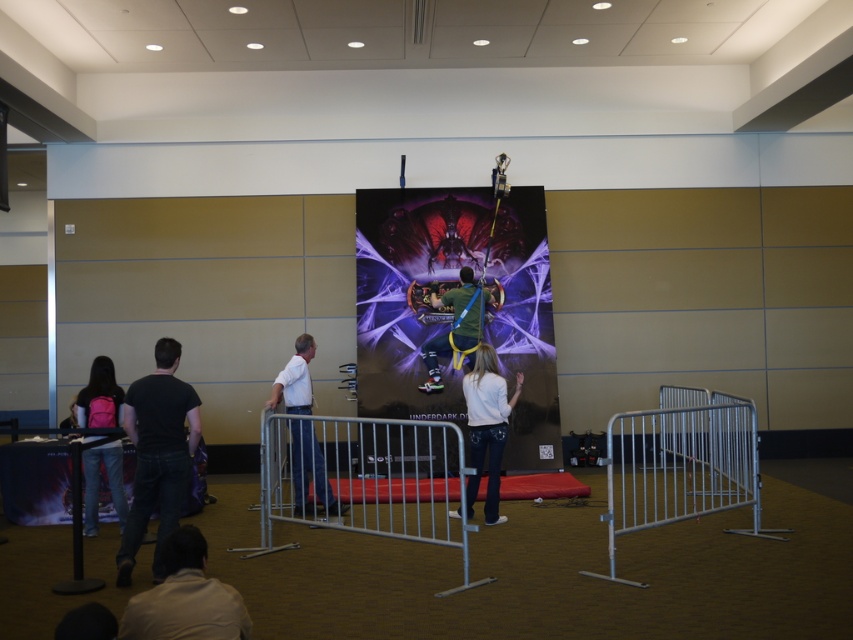
Consider the image. You are a technician at the event and need to attach a safety cable to the silver metallic rail at center and the white shirt at lower left. Which object should you attach the cable to first if you want to reach the higher one without moving your position?

The silver metallic rail at center has a greater height compared to the white shirt at lower left, so you should attach the cable to the silver metallic rail at center first since it is taller.

You are a visitor at the event and want to walk from the pink fabric backpack at lower left to the silver metallic barrier at lower right. Is the path between them wide enough for you to pass through comfortably?

The silver metallic barrier at lower right is wider than the pink fabric backpack at lower left, so the path between them is likely wide enough for you to pass through comfortably.

What is the position of the silver metallic rail at center in the image?

The silver metallic rail at center is located at point (x=364, y=477).